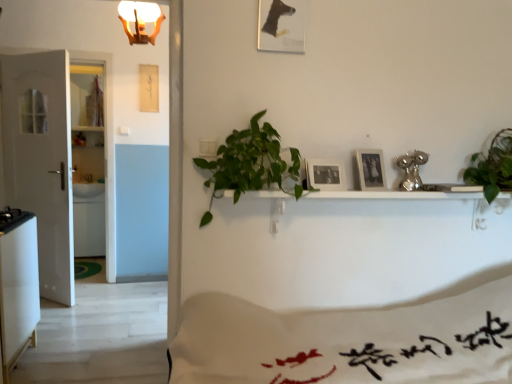
Describe the element at coordinates (347, 342) in the screenshot. This screenshot has height=384, width=512. I see `white fabric with red text at lower center` at that location.

You are a GUI agent. You are given a task and a screenshot of the screen. Output one action in this format:
    pyautogui.click(x=<x>, y=<y>)
    Task: Click on the matte paper picture frame at upper center, placed as the 1th picture frame when sorted from left to right
    Image resolution: width=512 pixels, height=384 pixels.
    Given the screenshot: What is the action you would take?
    pyautogui.click(x=281, y=25)

Find the location of `white glossy refrigerator at lower left`. white glossy refrigerator at lower left is located at coordinates (18, 285).

The image size is (512, 384). What do you see at coordinates (140, 20) in the screenshot? I see `gold metallic light fixture at upper center` at bounding box center [140, 20].

The width and height of the screenshot is (512, 384). In order to click on white fabric with red text at lower center in this screenshot , I will do click(x=347, y=342).

Which of these two, matte wooden picture frame at upper center, which appears as the first picture frame when viewed from the right, or gold metallic light fixture at upper center, stands shorter?

Standing shorter between the two is matte wooden picture frame at upper center, which appears as the first picture frame when viewed from the right.

Where is `light fixture that appears on the left of matte wooden picture frame at upper center, acting as the third picture frame starting from the left`? This screenshot has height=384, width=512. light fixture that appears on the left of matte wooden picture frame at upper center, acting as the third picture frame starting from the left is located at coordinates (140, 20).

Is matte wooden picture frame at upper center, the second picture frame from the bottom, oriented away from gold metallic light fixture at upper center?

No, matte wooden picture frame at upper center, the second picture frame from the bottom, is not facing away from gold metallic light fixture at upper center.

Can you confirm if matte wooden picture frame at upper center, the 2th picture frame from the top, is bigger than gold metallic light fixture at upper center?

No, matte wooden picture frame at upper center, the 2th picture frame from the top, is not bigger than gold metallic light fixture at upper center.

Looking at their sizes, would you say matte paper picture frame at upper center, placed as the third picture frame when sorted from right to left, is wider or thinner than white glossy refrigerator at lower left?

Considering their sizes, matte paper picture frame at upper center, placed as the third picture frame when sorted from right to left, looks slimmer than white glossy refrigerator at lower left.

Measure the distance between matte paper picture frame at upper center, placed as the 1th picture frame when sorted from left to right, and white glossy refrigerator at lower left.

matte paper picture frame at upper center, placed as the 1th picture frame when sorted from left to right, and white glossy refrigerator at lower left are 1.91 meters apart from each other.

From the image's perspective, does matte paper picture frame at upper center, the third picture frame in the bottom-to-top sequence, appear lower than white glossy refrigerator at lower left?

No, from the image's perspective, matte paper picture frame at upper center, the third picture frame in the bottom-to-top sequence, is not below white glossy refrigerator at lower left.

The width and height of the screenshot is (512, 384). Identify the location of appliance below the matte paper picture frame at upper center, the first picture frame in the top-to-bottom sequence (from a real-world perspective). (18, 285).

Considering the relative positions of green leafy plant at center, the 1th houseplant in the left-to-right sequence, and green leafy plant at right, which is the 1th houseplant from right to left, in the image provided, is green leafy plant at center, the 1th houseplant in the left-to-right sequence, to the left of green leafy plant at right, which is the 1th houseplant from right to left, from the viewer's perspective?

Yes.

How different are the orientations of green leafy plant at center, arranged as the 2th houseplant when viewed from the right, and green leafy plant at right, positioned as the 2th houseplant in left-to-right order, in degrees?

The facing directions of green leafy plant at center, arranged as the 2th houseplant when viewed from the right, and green leafy plant at right, positioned as the 2th houseplant in left-to-right order, are 1.12 degrees apart.

The height and width of the screenshot is (384, 512). Identify the location of houseplant that appears above the green leafy plant at center, arranged as the 2th houseplant when viewed from the right (from a real-world perspective). (492, 166).

Would you say green leafy plant at right, positioned as the 2th houseplant in left-to-right order, is part of green leafy plant at center, arranged as the 2th houseplant when viewed from the right,'s contents?

No, green leafy plant at right, positioned as the 2th houseplant in left-to-right order, is located outside of green leafy plant at center, arranged as the 2th houseplant when viewed from the right.

What's the angular difference between green leafy plant at center, arranged as the 2th houseplant when viewed from the right, and black matte picture frame at center, which appears as the 2th picture frame when viewed from the left,'s facing directions?

The angular difference between green leafy plant at center, arranged as the 2th houseplant when viewed from the right, and black matte picture frame at center, which appears as the 2th picture frame when viewed from the left, is 8.46 degrees.

Considering the sizes of objects green leafy plant at center, arranged as the 2th houseplant when viewed from the right, and black matte picture frame at center, the 2th picture frame positioned from the right, in the image provided, who is wider, green leafy plant at center, arranged as the 2th houseplant when viewed from the right, or black matte picture frame at center, the 2th picture frame positioned from the right,?

With larger width is green leafy plant at center, arranged as the 2th houseplant when viewed from the right.

From the image's perspective, is green leafy plant at center, the 1th houseplant in the left-to-right sequence, over black matte picture frame at center, the 2th picture frame positioned from the right?

No, from the image's perspective, green leafy plant at center, the 1th houseplant in the left-to-right sequence, is not over black matte picture frame at center, the 2th picture frame positioned from the right.

How distant is green leafy plant at center, arranged as the 2th houseplant when viewed from the right, from black matte picture frame at center, arranged as the first picture frame when ordered from the bottom?

12.39 inches.

Is gold metallic light fixture at upper center inside the boundaries of black matte picture frame at center, which appears as the 2th picture frame when viewed from the left, or outside?

gold metallic light fixture at upper center is located beyond the bounds of black matte picture frame at center, which appears as the 2th picture frame when viewed from the left.

From a real-world perspective, does gold metallic light fixture at upper center stand above black matte picture frame at center, arranged as the first picture frame when ordered from the bottom?

Yes, from a real-world perspective, gold metallic light fixture at upper center is above black matte picture frame at center, arranged as the first picture frame when ordered from the bottom.

Based on the photo, how different are the orientations of gold metallic light fixture at upper center and black matte picture frame at center, the 2th picture frame positioned from the right, in degrees?

7.87 degrees.

Locate an element on the screen. The width and height of the screenshot is (512, 384). light fixture located above the black matte picture frame at center, the 2th picture frame positioned from the right (from a real-world perspective) is located at coordinates (140, 20).

Measure the distance from white fabric with red text at lower center to white glossy refrigerator at lower left.

white fabric with red text at lower center is 1.54 meters away from white glossy refrigerator at lower left.

Between white fabric with red text at lower center and white glossy refrigerator at lower left, which one has more height?

white glossy refrigerator at lower left.

Does point (306, 362) come farther from viewer compared to point (29, 283)?

No, (306, 362) is closer to viewer.

Considering the relative positions of white fabric with red text at lower center and white glossy refrigerator at lower left in the image provided, is white fabric with red text at lower center to the left of white glossy refrigerator at lower left from the viewer's perspective?

No, white fabric with red text at lower center is not to the left of white glossy refrigerator at lower left.

Considering the relative sizes of white matte door at left and matte paper picture frame at upper center, placed as the 1th picture frame when sorted from left to right, in the image provided, is white matte door at left thinner than matte paper picture frame at upper center, placed as the 1th picture frame when sorted from left to right,?

No.

From the image's perspective, is white matte door at left above matte paper picture frame at upper center, the first picture frame in the top-to-bottom sequence?

No, from the image's perspective, white matte door at left is not above matte paper picture frame at upper center, the first picture frame in the top-to-bottom sequence.

Is white matte door at left with matte paper picture frame at upper center, the first picture frame in the top-to-bottom sequence?

No, white matte door at left is not with matte paper picture frame at upper center, the first picture frame in the top-to-bottom sequence.

Find the location of `picture frame that is the 1st object located in front of the gold metallic light fixture at upper center`. picture frame that is the 1st object located in front of the gold metallic light fixture at upper center is located at coordinates (371, 169).

The image size is (512, 384). In order to click on appliance that is under the matte paper picture frame at upper center, the first picture frame in the top-to-bottom sequence (from a real-world perspective) in this screenshot , I will do `click(18, 285)`.

From the image, which object appears to be farther from green leafy plant at center, the 1th houseplant in the left-to-right sequence, white matte door at left or white glossy refrigerator at lower left?

white matte door at left is positioned further to the anchor green leafy plant at center, the 1th houseplant in the left-to-right sequence.

When comparing their distances from matte wooden picture frame at upper center, the 2th picture frame from the top, does white glossy refrigerator at lower left or black matte picture frame at center, arranged as the first picture frame when ordered from the bottom, seem closer?

black matte picture frame at center, arranged as the first picture frame when ordered from the bottom, is positioned closer to the anchor matte wooden picture frame at upper center, the 2th picture frame from the top.

Based on their spatial positions, is white glossy refrigerator at lower left or white fabric with red text at lower center further from white matte door at left?

white fabric with red text at lower center is further to white matte door at left.

Considering their positions, is white fabric with red text at lower center positioned further to black matte picture frame at center, which appears as the 2th picture frame when viewed from the left, than matte wooden picture frame at upper center, the second picture frame from the bottom?

white fabric with red text at lower center is further to black matte picture frame at center, which appears as the 2th picture frame when viewed from the left.

Which object lies further to the anchor point matte wooden picture frame at upper center, which appears as the first picture frame when viewed from the right, black matte picture frame at center, which appears as the 2th picture frame when viewed from the left, or matte paper picture frame at upper center, placed as the 1th picture frame when sorted from left to right?

matte paper picture frame at upper center, placed as the 1th picture frame when sorted from left to right, lies further to matte wooden picture frame at upper center, which appears as the first picture frame when viewed from the right, than the other object.

Considering their positions, is matte paper picture frame at upper center, the first picture frame in the top-to-bottom sequence, positioned further to white fabric with red text at lower center than green leafy plant at right, which is the 1th houseplant from right to left?

The object further to white fabric with red text at lower center is matte paper picture frame at upper center, the first picture frame in the top-to-bottom sequence.

Based on their spatial positions, is white fabric with red text at lower center or white glossy refrigerator at lower left closer to gold metallic light fixture at upper center?

white glossy refrigerator at lower left is positioned closer to the anchor gold metallic light fixture at upper center.

Estimate the real-world distances between objects in this image. Which object is closer to white matte door at left, green leafy plant at right, which is the 1th houseplant from right to left, or black matte picture frame at center, which is the third picture frame from top to bottom?

black matte picture frame at center, which is the third picture frame from top to bottom, is positioned closer to the anchor white matte door at left.

Where is `picture frame that lies between matte paper picture frame at upper center, placed as the 1th picture frame when sorted from left to right, and black matte picture frame at center, which is the third picture frame from top to bottom, from top to bottom`? picture frame that lies between matte paper picture frame at upper center, placed as the 1th picture frame when sorted from left to right, and black matte picture frame at center, which is the third picture frame from top to bottom, from top to bottom is located at coordinates (371, 169).

The height and width of the screenshot is (384, 512). I want to click on picture frame located between white glossy refrigerator at lower left and black matte picture frame at center, which appears as the 2th picture frame when viewed from the left, in the left-right direction, so click(x=281, y=25).

The width and height of the screenshot is (512, 384). Find the location of `light fixture between white glossy refrigerator at lower left and matte wooden picture frame at upper center, acting as the third picture frame starting from the left, from left to right`. light fixture between white glossy refrigerator at lower left and matte wooden picture frame at upper center, acting as the third picture frame starting from the left, from left to right is located at coordinates (140, 20).

Identify the location of houseplant situated between white glossy refrigerator at lower left and black matte picture frame at center, the 2th picture frame positioned from the right, from left to right. The image size is (512, 384). (252, 161).